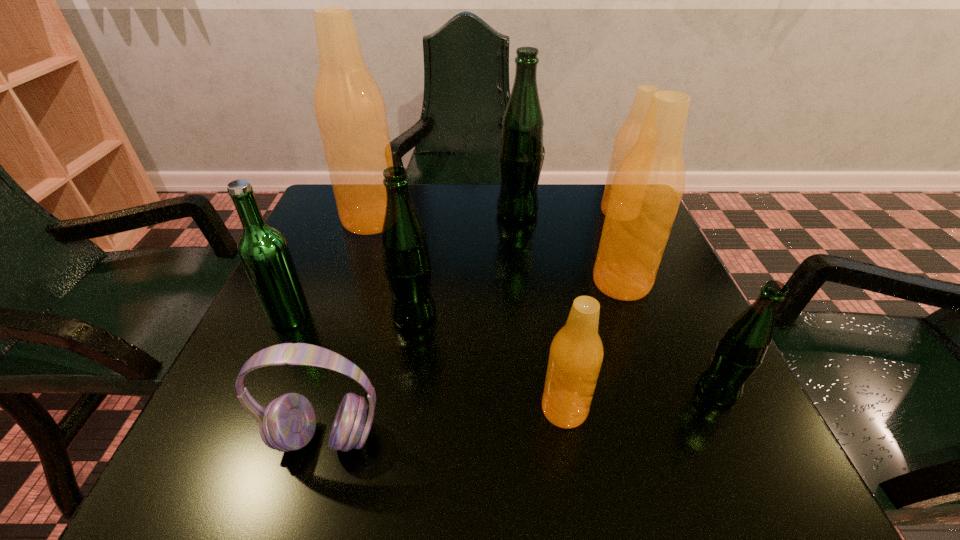
Find the location of `the leftmost tan beer bottle`. the leftmost tan beer bottle is located at coordinates (349, 108).

Locate an element on the screen. The width and height of the screenshot is (960, 540). the tallest object is located at coordinates (349, 108).

The width and height of the screenshot is (960, 540). What are the coordinates of `the biggest green beer bottle` in the screenshot? It's located at (521, 152).

I want to click on the second green beer bottle from right to left, so click(x=521, y=152).

Locate an element on the screen. The height and width of the screenshot is (540, 960). the second nearest tan beer bottle is located at coordinates (648, 185).

The height and width of the screenshot is (540, 960). I want to click on the second smallest tan beer bottle, so click(x=627, y=134).

Identify the location of the sixth beer bottle from right to left. (406, 260).

The width and height of the screenshot is (960, 540). Identify the location of the leftmost green beer bottle. (263, 250).

Where is `the nearest green beer bottle`? the nearest green beer bottle is located at coordinates (740, 351).

Find the location of a particular element. This screenshot has height=540, width=960. the rightmost green beer bottle is located at coordinates (740, 351).